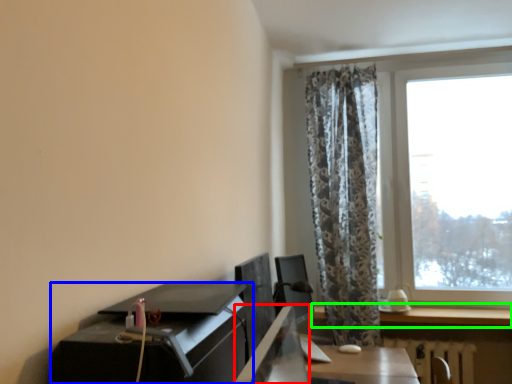
Question: Which object is positioned farthest from desktop (highlighted by a red box)? Select from desk (highlighted by a blue box) and window (highlighted by a green box).

Choices:
 (A) desk
 (B) window

Answer: (B)